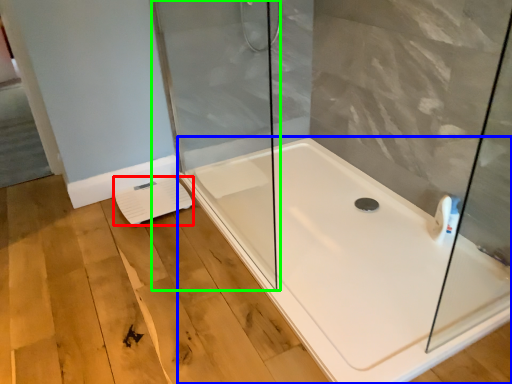
Question: Which object is the farthest from lift (highlighted by a red box)? Choose among these: bathtub (highlighted by a blue box) or shower door (highlighted by a green box).

Choices:
 (A) bathtub
 (B) shower door

Answer: (A)